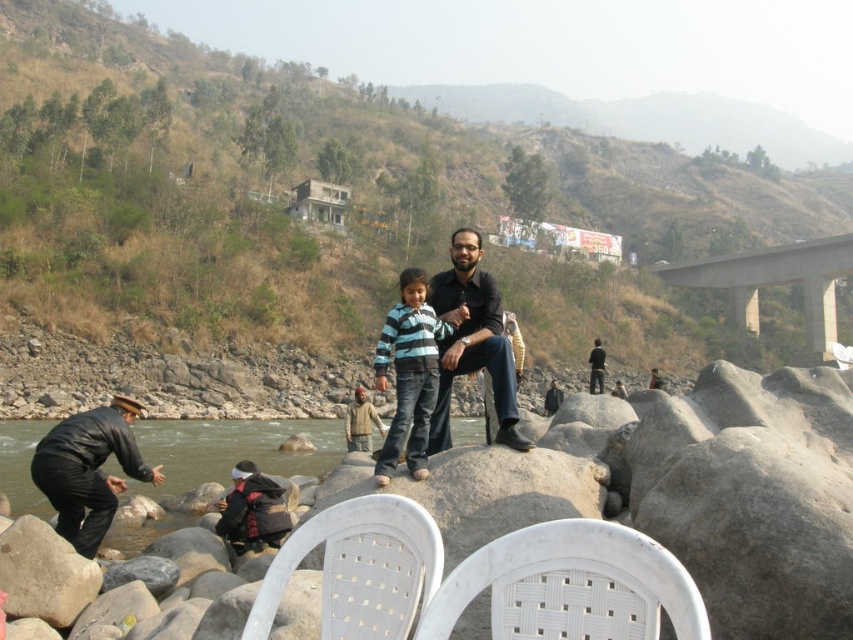
Question: Estimate the real-world distances between objects in this image. Which object is farther from the brown grassy hillside at upper left?

Choices:
 (A) striped cotton shirt at center
 (B) matte black shirt at center
 (C) black leather jacket at lower left
 (D) white plastic chair at center

Answer: (B)

Question: Among these points, which one is nearest to the camera?

Choices:
 (A) (593, 390)
 (B) (402, 348)
 (C) (376, 522)

Answer: (C)

Question: Observing the image, what is the correct spatial positioning of white plastic chair at lower center in reference to black leather jacket at lower left?

Choices:
 (A) left
 (B) right

Answer: (B)

Question: Which object appears farthest from the camera in this image?

Choices:
 (A) brown grassy hillside at upper left
 (B) dark brown leather jacket at center

Answer: (A)

Question: Considering the relative positions of brown grassy hillside at upper left and white plastic chair at center in the image provided, where is brown grassy hillside at upper left located with respect to white plastic chair at center?

Choices:
 (A) below
 (B) above

Answer: (B)

Question: Does matte black shirt at center come behind striped cotton shirt at center?

Choices:
 (A) yes
 (B) no

Answer: (A)